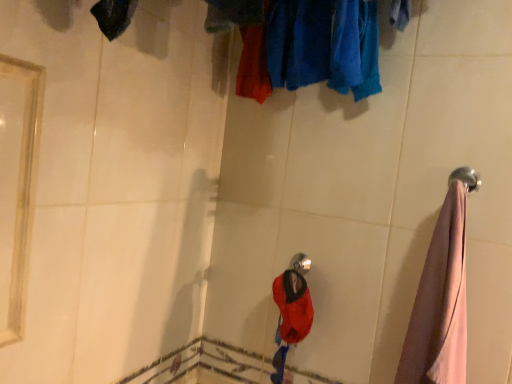
Question: From the image's perspective, does shiny metallic shower head at center appear lower than pink fabric towel at right?

Choices:
 (A) yes
 (B) no

Answer: (B)

Question: From the image's perspective, is shiny metallic shower head at center on top of pink fabric towel at right?

Choices:
 (A) yes
 (B) no

Answer: (A)

Question: Is shiny metallic shower head at center directly adjacent to pink fabric towel at right?

Choices:
 (A) no
 (B) yes

Answer: (A)

Question: Is shiny metallic shower head at center not close to pink fabric towel at right?

Choices:
 (A) yes
 (B) no

Answer: (B)

Question: Considering the relative sizes of shiny metallic shower head at center and pink fabric towel at right in the image provided, is shiny metallic shower head at center smaller than pink fabric towel at right?

Choices:
 (A) no
 (B) yes

Answer: (B)

Question: Would you say velvet-like red hat at center is to the left or to the right of pink fabric towel at right in the picture?

Choices:
 (A) left
 (B) right

Answer: (A)

Question: From a real-world perspective, relative to pink fabric towel at right, is velvet-like red hat at center vertically above or below?

Choices:
 (A) below
 (B) above

Answer: (A)

Question: Does point (290, 271) appear closer or farther from the camera than point (457, 314)?

Choices:
 (A) closer
 (B) farther

Answer: (B)

Question: Considering the positions of velvet-like red hat at center and pink fabric towel at right in the image, is velvet-like red hat at center wider or thinner than pink fabric towel at right?

Choices:
 (A) wide
 (B) thin

Answer: (B)

Question: Is polished silver towel rack at right in front of or behind velvet-like red hat at center in the image?

Choices:
 (A) behind
 (B) front

Answer: (B)

Question: From the image's perspective, is polished silver towel rack at right positioned above or below velvet-like red hat at center?

Choices:
 (A) below
 (B) above

Answer: (B)

Question: In terms of height, does polished silver towel rack at right look taller or shorter compared to velvet-like red hat at center?

Choices:
 (A) tall
 (B) short

Answer: (B)

Question: Would you say polished silver towel rack at right is to the left or to the right of velvet-like red hat at center in the picture?

Choices:
 (A) left
 (B) right

Answer: (B)

Question: Is shiny metallic shower head at center in front of or behind pink fabric towel at right in the image?

Choices:
 (A) behind
 (B) front

Answer: (A)

Question: Looking at their shapes, would you say shiny metallic shower head at center is wider or thinner than pink fabric towel at right?

Choices:
 (A) thin
 (B) wide

Answer: (A)